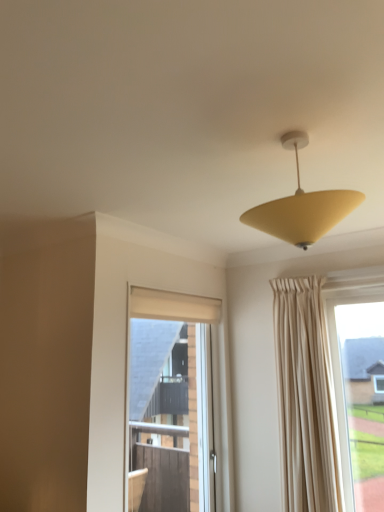
Question: From the image's perspective, is matte yellow cone at upper center located above or below matte glass window at center?

Choices:
 (A) above
 (B) below

Answer: (A)

Question: Considering the positions of matte yellow cone at upper center and matte glass window at center in the image, is matte yellow cone at upper center wider or thinner than matte glass window at center?

Choices:
 (A) thin
 (B) wide

Answer: (B)

Question: Is matte yellow cone at upper center bigger or smaller than matte glass window at center?

Choices:
 (A) small
 (B) big

Answer: (A)

Question: From a real-world perspective, is matte glass window at center physically located above or below matte yellow cone at upper center?

Choices:
 (A) above
 (B) below

Answer: (B)

Question: Considering the positions of point (165, 300) and point (274, 202), is point (165, 300) closer or farther from the camera than point (274, 202)?

Choices:
 (A) farther
 (B) closer

Answer: (A)

Question: From the image's perspective, is matte glass window at center located above or below matte yellow cone at upper center?

Choices:
 (A) above
 (B) below

Answer: (B)

Question: Is matte glass window at center wider or thinner than matte yellow cone at upper center?

Choices:
 (A) wide
 (B) thin

Answer: (B)